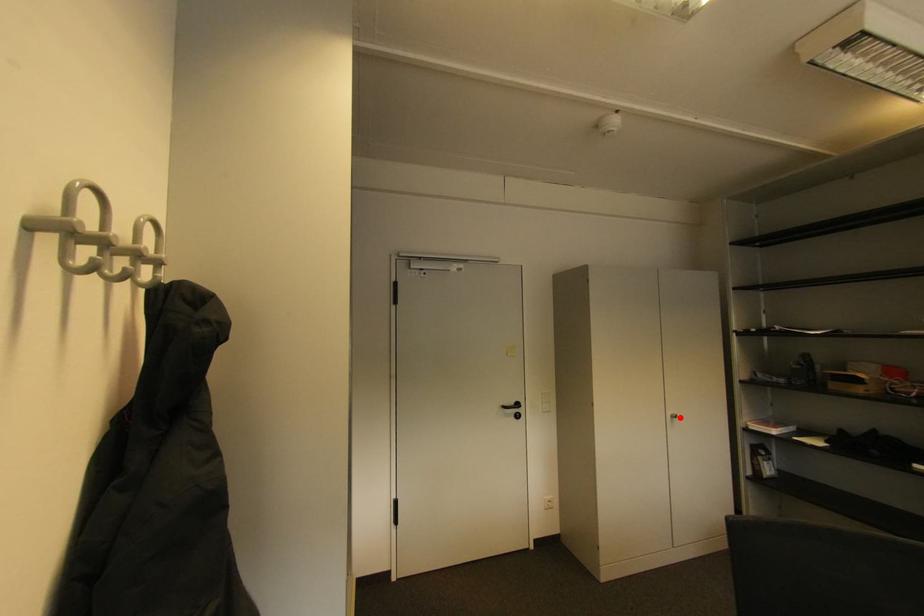
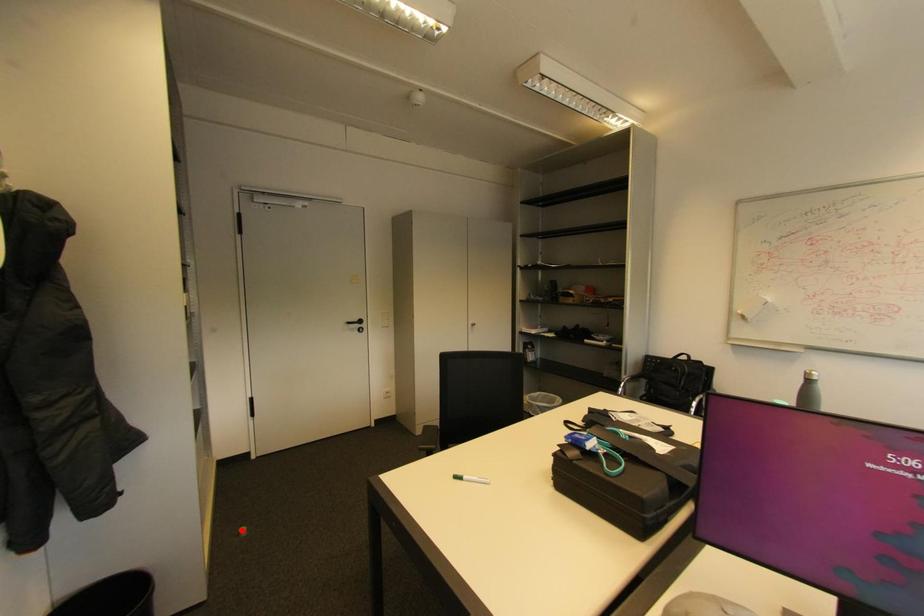
I am providing you with two images of the same scene from different viewpoints. A red point is marked on the first image and another point is marked on the second image. Are the points marked in image1 and image2 representing the same 3D position?

No